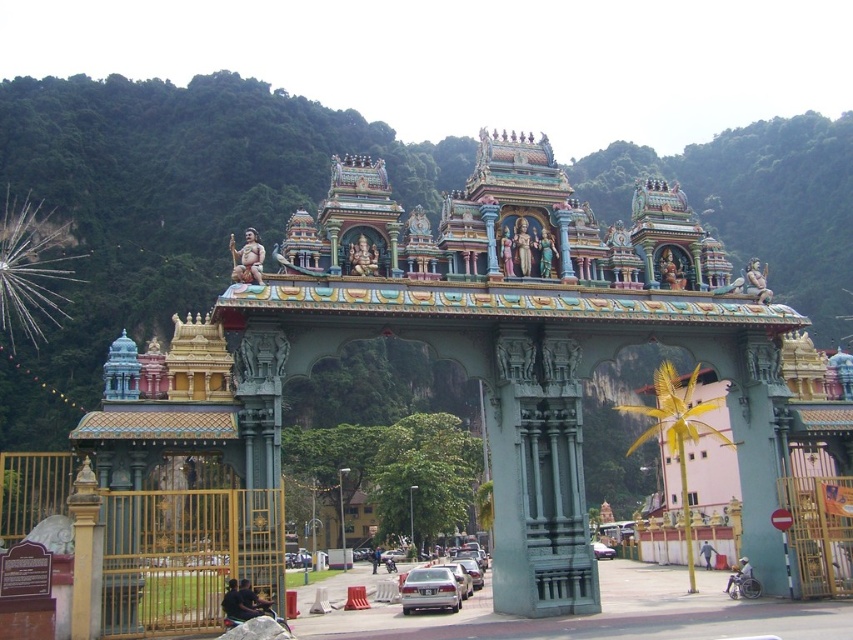
Question: Among these points, which one is nearest to the camera?

Choices:
 (A) (375, 572)
 (B) (518, 244)

Answer: (B)

Question: Which point is farther to the camera?

Choices:
 (A) silver metallic sedan at center
 (B) metallic silver car at center
 (C) green stone gate at center
 (D) polished gold statue at center

Answer: (D)

Question: Is silver metallic sedan at center positioned behind dark blue fabric person at center?

Choices:
 (A) yes
 (B) no

Answer: (B)

Question: Does green stone gate at center have a smaller size compared to polished bronze statue at center?

Choices:
 (A) no
 (B) yes

Answer: (A)

Question: Which of the following is the farthest from the observer?

Choices:
 (A) (598, 544)
 (B) (258, 612)

Answer: (A)

Question: Can you confirm if green stone gate at center is positioned below metallic silver car at center?

Choices:
 (A) yes
 (B) no

Answer: (B)